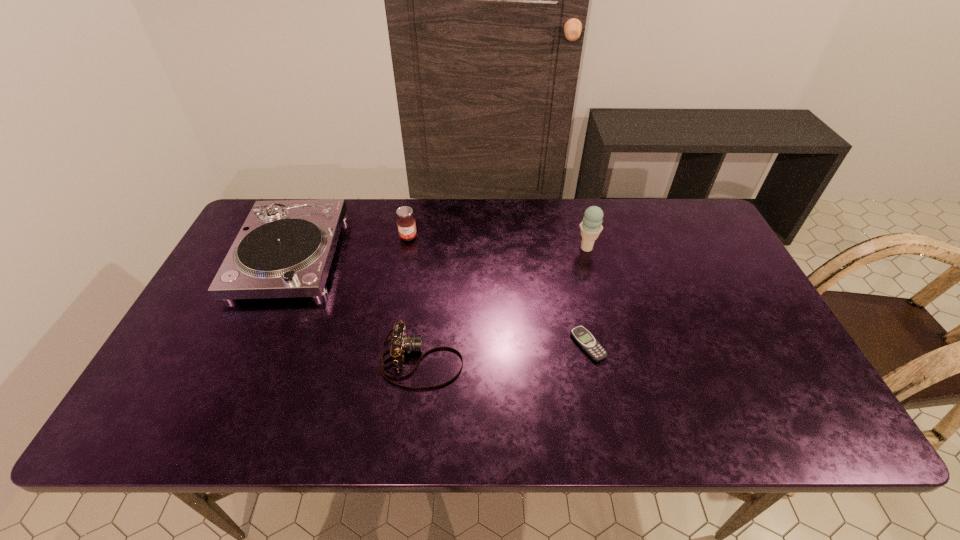
At what (x,y) coordinates should I click in order to perform the action: click on the tallest object. Please return your answer as a coordinate pair (x, y). Looking at the image, I should click on (590, 227).

Image resolution: width=960 pixels, height=540 pixels. Find the location of `jam`. jam is located at coordinates (406, 224).

Where is `record player`? The image size is (960, 540). record player is located at coordinates (285, 248).

Identify the location of the second shortest object. This screenshot has height=540, width=960. (401, 343).

Identify the location of beeper. This screenshot has height=540, width=960. (580, 334).

The image size is (960, 540). I want to click on vacant region located on the front of the ice cream, so click(x=601, y=306).

Identify the location of vacant space located 0.050m on the label side of the jam. Image resolution: width=960 pixels, height=540 pixels. (405, 254).

The width and height of the screenshot is (960, 540). In order to click on free region located on the right of the record player in this screenshot , I will do `click(397, 255)`.

This screenshot has height=540, width=960. What are the coordinates of `vacant area situated on the front-facing side of the camera` in the screenshot? It's located at (564, 360).

Image resolution: width=960 pixels, height=540 pixels. I want to click on vacant space located on the right of the beeper, so (668, 345).